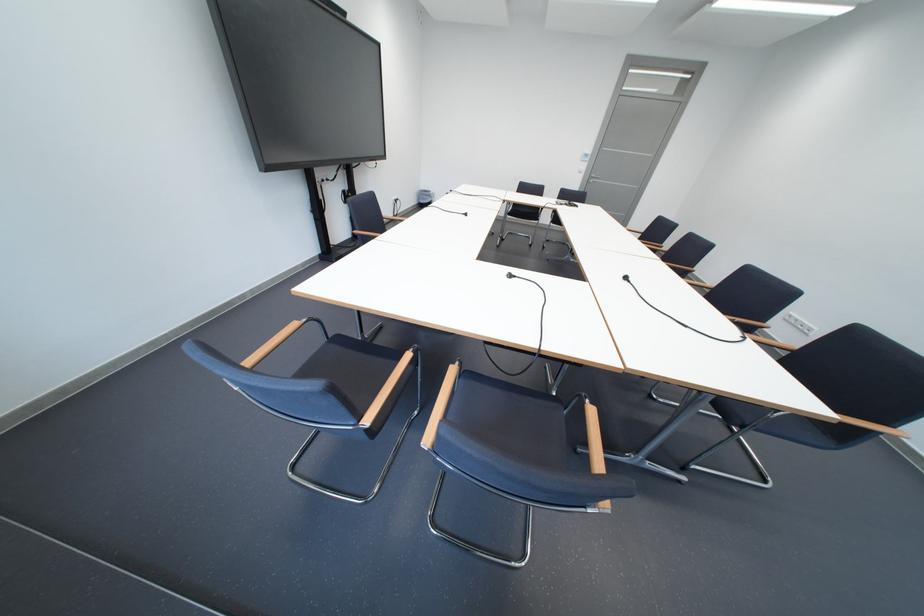
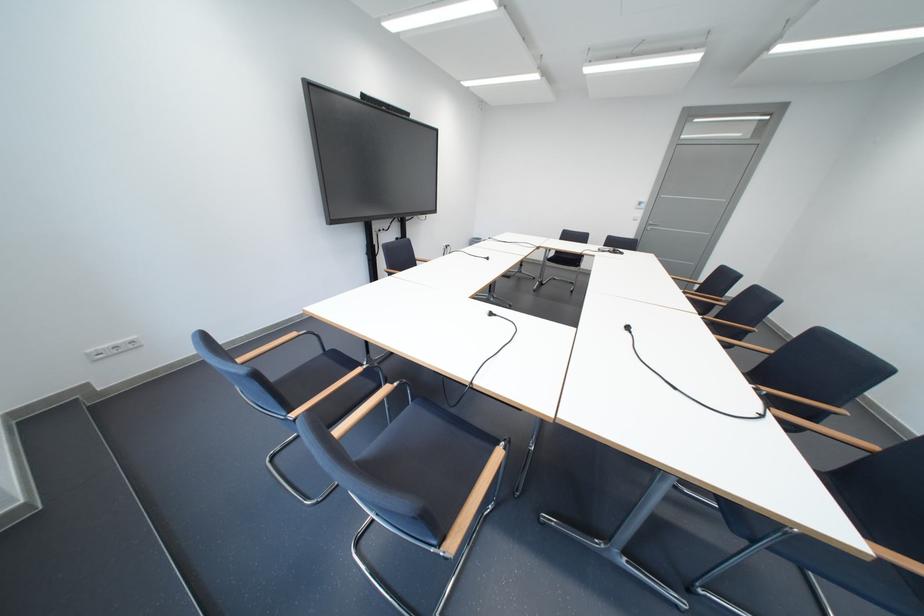
Question: In a continuous first-person perspective shot, in which direction is the camera moving?

Choices:
 (A) Left
 (B) Right
 (C) Forward
 (D) Backward

Answer: (B)